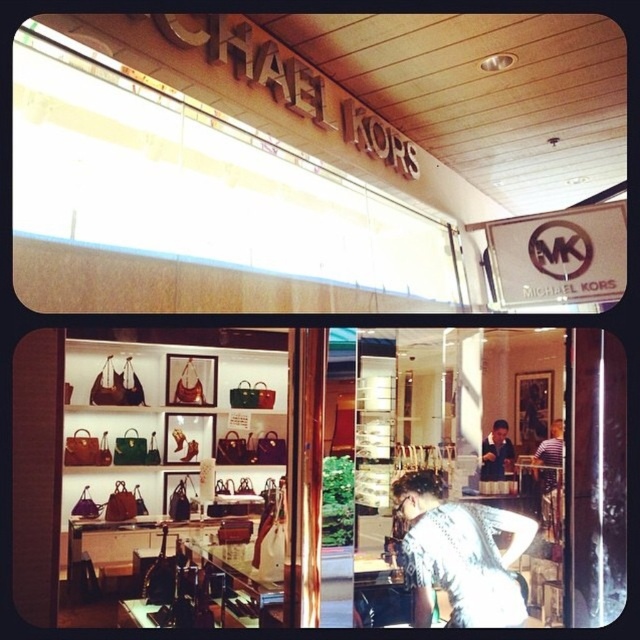
You are a customer in the store and want to place the striped shirt at center on top of the matte black handbags at center. Can you do this without moving any other items?

The matte black handbags at center and striped shirt at center are 11.39 inches apart from each other. Since the distance between them is more than enough to place the striped shirt on top, you can do this without moving other items.

You are a customer standing in the Michael Kors store. You notice the matte black handbags at center and the dark blue shirt at center. Which item is taller?

The matte black handbags at center are taller than the dark blue shirt at center.

You are a store employee organizing the display. You need to place a new striped shirt at center and ensure it doesn not block the view of the matte black handbags at center. Given their sizes, is this arrangement feasible?

The matte black handbags at center are wider than the striped shirt at center, so placing the striped shirt at center in front would still allow the handbags to be visible from the sides since the handbags are wider.